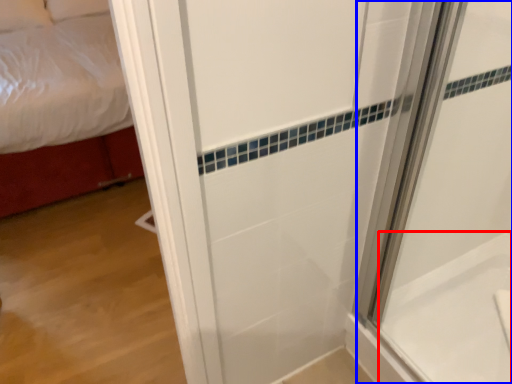
Question: Which point is closer to the camera, bath (highlighted by a red box) or shower door (highlighted by a blue box)?

Choices:
 (A) bath
 (B) shower door

Answer: (B)